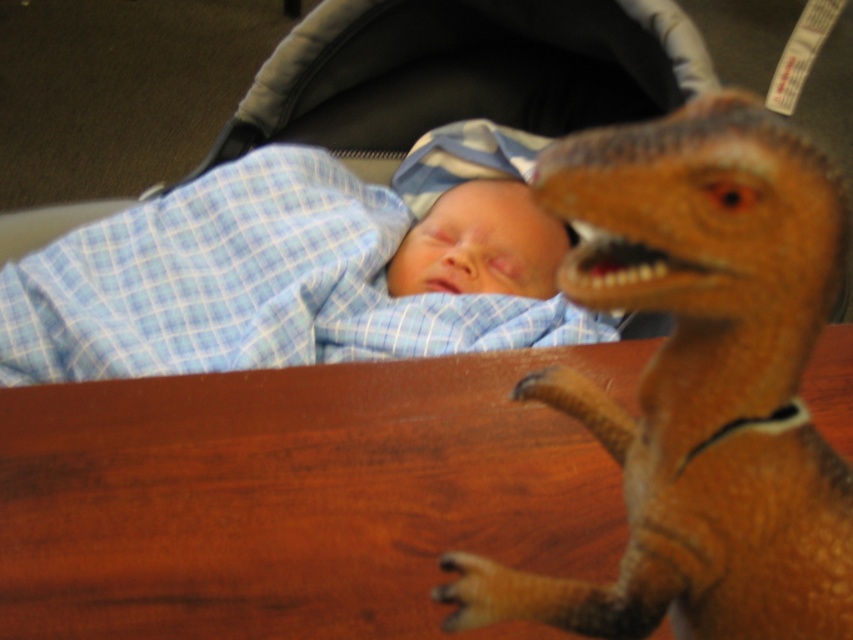
You are a parent who wants to place a small toy near your sleeping baby without disturbing them. The baby is under the blue checkered blanket at upper left. You have a brown textured dinosaur at center. Where should you place the dinosaur to avoid waking the baby?

The brown textured dinosaur at center should be placed below the blue checkered blanket at upper left to avoid waking the baby, as the dinosaur is already located below the blanket and this position is less likely to disturb the baby.

You are a photographer trying to capture a close up of the baby sleeping in the stroller. You need to place a camera on the brown wood table at center. Where should you position the camera on the table to ensure the baby is in the frame?

The brown wood table at center is located at coordinates point (297, 497). Position the camera there to capture the baby in the frame.

You are a parent trying to place a small toy on the brown wood table at center. The blue checkered blanket at upper left is currently on the table. Do you think the table is wide enough to accommodate both the blanket and the toy without the toy hanging off the edge?

The brown wood table at center might be wider than blue checkered blanket at upper left, so there might be enough space for the toy to be placed alongside the blanket without hanging off the edge.